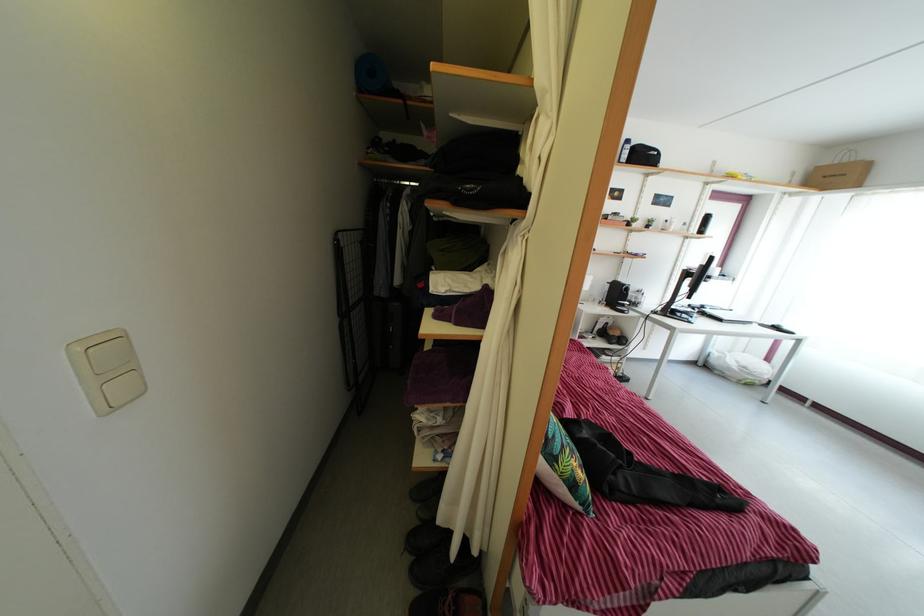
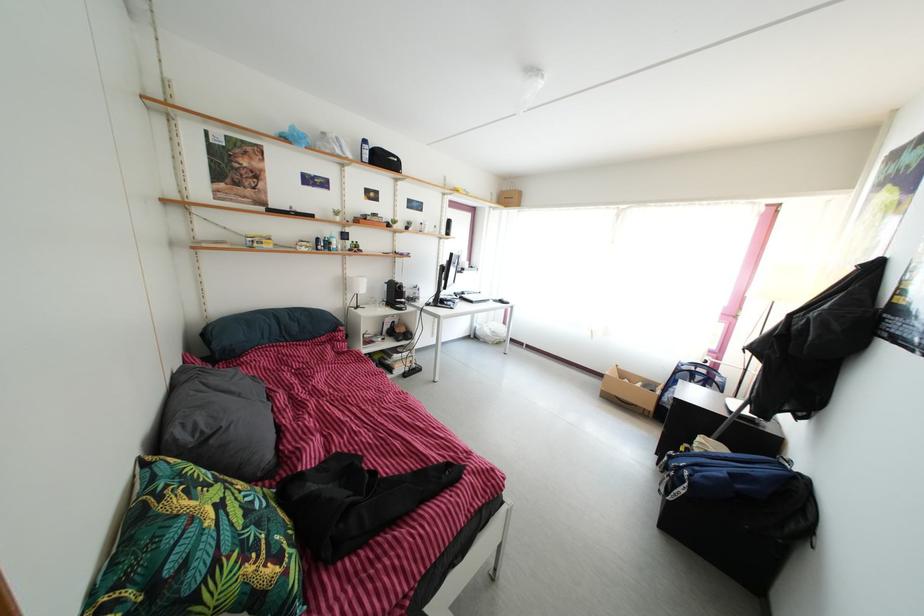
In the second image, find the point that corresponds to point 617,341 in the first image.

(405, 339)